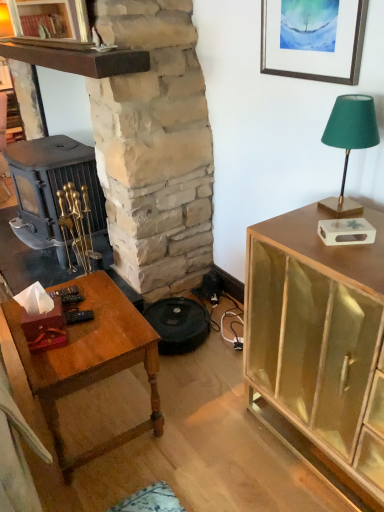
Locate an element on the screen. vacant space to the left of green fabric lampshade at upper right is located at coordinates (295, 222).